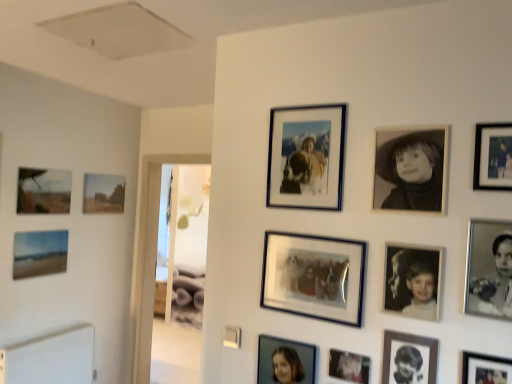
Question: Considering the positions of point (96, 183) and point (288, 360), is point (96, 183) closer or farther from the camera than point (288, 360)?

Choices:
 (A) farther
 (B) closer

Answer: (A)

Question: In the image, is matte brown landscape at left, which is counted as the thirteenth picture frame, starting from the front, on the left side or the right side of matte silver photo frame at lower center, placed as the tenth picture frame when sorted from front to back?

Choices:
 (A) left
 (B) right

Answer: (A)

Question: Estimate the real-world distances between objects in this image. Which object is closer to the metallic silver photo frame at lower center, placed as the 7th picture frame when sorted from front to back?

Choices:
 (A) matte silver photo frame at lower center, placed as the tenth picture frame when sorted from front to back
 (B) matte blue painting at lower left, the 2th picture frame viewed from the back
 (C) metallic silver photo frame at lower right, which is the 11th picture frame in left-to-right order
 (D) metallic silver photo frame at upper center, which is the 5th picture frame from back to front
 (E) matte brown landscape at left, the 11th picture frame when ordered from right to left

Answer: (A)

Question: Estimate the real-world distances between objects in this image. Which object is closer to the matte black picture frame at upper right, placed as the eleventh picture frame when sorted from back to front?

Choices:
 (A) matte canvas painting at left, placed as the third picture frame when sorted from back to front
 (B) black glossy photo frame at lower right, which is the 2th picture frame in right-to-left order
 (C) metallic silver photo frame at lower right, which is the 11th picture frame in left-to-right order
 (D) black matte portrait at upper right, the ninth picture frame in the left-to-right sequence
 (E) frosted glass photo frame at center, which is the 8th picture frame from front to back

Answer: (D)